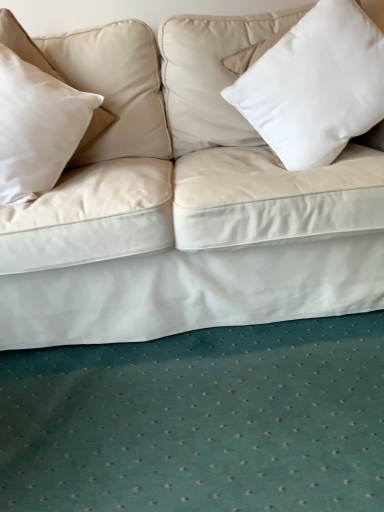
In order to face beige fabric pillow at left, the 1th pillow viewed from the left, should I rotate leftwards or rightwards?

To face it directly, rotate left by 20.512 degrees.

What do you see at coordinates (37, 127) in the screenshot? The height and width of the screenshot is (512, 384). I see `beige fabric pillow at left, the 2th pillow in the right-to-left sequence` at bounding box center [37, 127].

Where is `beige fabric pillow at left, the 2th pillow in the right-to-left sequence`? The height and width of the screenshot is (512, 384). beige fabric pillow at left, the 2th pillow in the right-to-left sequence is located at coordinates (37, 127).

Identify the location of white matte pillow at upper right, which is the 1th pillow in right-to-left order. This screenshot has height=512, width=384. (316, 85).

This screenshot has width=384, height=512. What do you see at coordinates (316, 85) in the screenshot?
I see `white matte pillow at upper right, which is the 1th pillow in right-to-left order` at bounding box center [316, 85].

Locate an element on the screen. The width and height of the screenshot is (384, 512). beige fabric pillow at left, the 1th pillow viewed from the left is located at coordinates (37, 127).

Based on their positions, is beige fabric pillow at left, the 2th pillow in the right-to-left sequence, located to the left or right of white matte pillow at upper right, which is the 1th pillow in right-to-left order?

From the image, it's evident that beige fabric pillow at left, the 2th pillow in the right-to-left sequence, is to the left of white matte pillow at upper right, which is the 1th pillow in right-to-left order.

In the image, is beige fabric pillow at left, the 2th pillow in the right-to-left sequence, positioned in front of or behind white matte pillow at upper right, which is the 1th pillow in right-to-left order?

In the image, beige fabric pillow at left, the 2th pillow in the right-to-left sequence, appears in front of white matte pillow at upper right, which is the 1th pillow in right-to-left order.

Which is closer, (45,106) or (331,17)?

Point (45,106) is positioned farther from the camera compared to point (331,17).

From the image's perspective, is beige fabric pillow at left, the 1th pillow viewed from the left, below white matte pillow at upper right, the 2th pillow in the left-to-right sequence?

Yes, from the image's perspective, beige fabric pillow at left, the 1th pillow viewed from the left, is below white matte pillow at upper right, the 2th pillow in the left-to-right sequence.

In the scene shown: From a real-world perspective, between beige fabric pillow at left, the 2th pillow in the right-to-left sequence, and white matte pillow at upper right, the 2th pillow in the left-to-right sequence, who is vertically lower?

In real-world perspective, white matte pillow at upper right, the 2th pillow in the left-to-right sequence, is lower.

Is beige fabric pillow at left, the 1th pillow viewed from the left, thinner than white matte pillow at upper right, the 2th pillow in the left-to-right sequence?

In fact, beige fabric pillow at left, the 1th pillow viewed from the left, might be wider than white matte pillow at upper right, the 2th pillow in the left-to-right sequence.

Between beige fabric pillow at left, the 1th pillow viewed from the left, and white matte pillow at upper right, which is the 1th pillow in right-to-left order, which one has less height?

beige fabric pillow at left, the 1th pillow viewed from the left.

Who is smaller, beige fabric pillow at left, the 1th pillow viewed from the left, or white matte pillow at upper right, which is the 1th pillow in right-to-left order?

beige fabric pillow at left, the 1th pillow viewed from the left.

Do you think beige fabric pillow at left, the 2th pillow in the right-to-left sequence, is within white matte pillow at upper right, the 2th pillow in the left-to-right sequence, or outside of it?

beige fabric pillow at left, the 2th pillow in the right-to-left sequence, is outside white matte pillow at upper right, the 2th pillow in the left-to-right sequence.

Is beige fabric pillow at left, the 2th pillow in the right-to-left sequence, far from white matte pillow at upper right, which is the 1th pillow in right-to-left order?

No.

Is beige fabric pillow at left, the 2th pillow in the right-to-left sequence, positioned with its back to white matte pillow at upper right, which is the 1th pillow in right-to-left order?

No, white matte pillow at upper right, which is the 1th pillow in right-to-left order, is not at the back of beige fabric pillow at left, the 2th pillow in the right-to-left sequence.

How many degrees apart are the facing directions of beige fabric pillow at left, the 2th pillow in the right-to-left sequence, and white matte pillow at upper right, the 2th pillow in the left-to-right sequence?

There is a 38.8-degree angle between the facing directions of beige fabric pillow at left, the 2th pillow in the right-to-left sequence, and white matte pillow at upper right, the 2th pillow in the left-to-right sequence.

Identify the location of pillow above the beige fabric pillow at left, the 2th pillow in the right-to-left sequence (from the image's perspective). The height and width of the screenshot is (512, 384). (316, 85).

Between white matte pillow at upper right, the 2th pillow in the left-to-right sequence, and beige fabric pillow at left, the 2th pillow in the right-to-left sequence, which one appears on the left side from the viewer's perspective?

From the viewer's perspective, beige fabric pillow at left, the 2th pillow in the right-to-left sequence, appears more on the left side.

Based on the photo, which is behind, white matte pillow at upper right, which is the 1th pillow in right-to-left order, or beige fabric pillow at left, the 2th pillow in the right-to-left sequence?

white matte pillow at upper right, which is the 1th pillow in right-to-left order, is further away from the camera.

Between point (331, 73) and point (74, 145), which one is positioned behind?

The point (74, 145) is more distant.

From the image's perspective, is white matte pillow at upper right, which is the 1th pillow in right-to-left order, under beige fabric pillow at left, the 1th pillow viewed from the left?

Incorrect, from the image's perspective, white matte pillow at upper right, which is the 1th pillow in right-to-left order, is higher than beige fabric pillow at left, the 1th pillow viewed from the left.

From a real-world perspective, which is physically below, white matte pillow at upper right, the 2th pillow in the left-to-right sequence, or beige fabric pillow at left, the 1th pillow viewed from the left?

In real-world perspective, white matte pillow at upper right, the 2th pillow in the left-to-right sequence, is lower.

Which object is wider, white matte pillow at upper right, which is the 1th pillow in right-to-left order, or beige fabric pillow at left, the 2th pillow in the right-to-left sequence?

beige fabric pillow at left, the 2th pillow in the right-to-left sequence, is wider.

Does white matte pillow at upper right, which is the 1th pillow in right-to-left order, have a greater height compared to beige fabric pillow at left, the 2th pillow in the right-to-left sequence?

Yes.

Is white matte pillow at upper right, which is the 1th pillow in right-to-left order, smaller than beige fabric pillow at left, the 2th pillow in the right-to-left sequence?

No.

Is white matte pillow at upper right, which is the 1th pillow in right-to-left order, surrounding beige fabric pillow at left, the 1th pillow viewed from the left?

No, white matte pillow at upper right, which is the 1th pillow in right-to-left order, does not contain beige fabric pillow at left, the 1th pillow viewed from the left.

Is white matte pillow at upper right, the 2th pillow in the left-to-right sequence, far from beige fabric pillow at left, the 2th pillow in the right-to-left sequence?

No, white matte pillow at upper right, the 2th pillow in the left-to-right sequence, is in close proximity to beige fabric pillow at left, the 2th pillow in the right-to-left sequence.

In the scene shown: Is white matte pillow at upper right, the 2th pillow in the left-to-right sequence, aimed at beige fabric pillow at left, the 1th pillow viewed from the left?

No, white matte pillow at upper right, the 2th pillow in the left-to-right sequence, is not facing towards beige fabric pillow at left, the 1th pillow viewed from the left.

Can you tell me how much white matte pillow at upper right, which is the 1th pillow in right-to-left order, and beige fabric pillow at left, the 2th pillow in the right-to-left sequence, differ in facing direction?

The angle between the facing direction of white matte pillow at upper right, which is the 1th pillow in right-to-left order, and the facing direction of beige fabric pillow at left, the 2th pillow in the right-to-left sequence, is 38.8 degrees.

You are a GUI agent. You are given a task and a screenshot of the screen. Output one action in this format:
    pyautogui.click(x=<x>, y=<y>)
    Task: Click on the pillow that is above the beige fabric pillow at left, the 1th pillow viewed from the left (from the image's perspective)
    The image size is (384, 512).
    Given the screenshot: What is the action you would take?
    pyautogui.click(x=316, y=85)

Identify the location of pillow on the left of white matte pillow at upper right, the 2th pillow in the left-to-right sequence. (37, 127).

The width and height of the screenshot is (384, 512). I want to click on pillow behind the beige fabric pillow at left, the 1th pillow viewed from the left, so click(x=316, y=85).